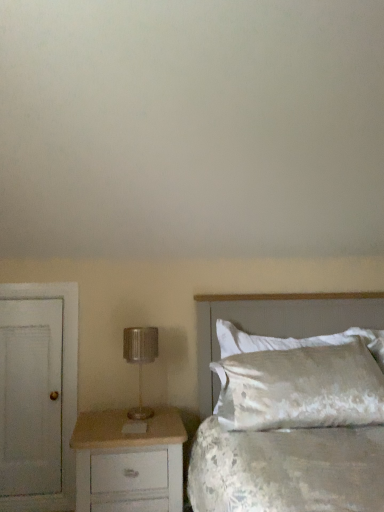
Question: Is metallic silver lamp at left turned away from satin white pillow at right?

Choices:
 (A) no
 (B) yes

Answer: (A)

Question: Does metallic silver lamp at left come in front of satin white pillow at right?

Choices:
 (A) yes
 (B) no

Answer: (A)

Question: Could you tell me if metallic silver lamp at left is turned towards satin white pillow at right?

Choices:
 (A) no
 (B) yes

Answer: (A)

Question: Is metallic silver lamp at left with satin white pillow at right?

Choices:
 (A) no
 (B) yes

Answer: (A)

Question: Does metallic silver lamp at left have a greater width compared to satin white pillow at right?

Choices:
 (A) yes
 (B) no

Answer: (A)

Question: From the image's perspective, would you say metallic silver lamp at left is positioned over satin white pillow at right?

Choices:
 (A) no
 (B) yes

Answer: (B)

Question: Considering the relative sizes of white matte door at left and white painted wood chest of drawers at lower left in the image provided, is white matte door at left bigger than white painted wood chest of drawers at lower left?

Choices:
 (A) no
 (B) yes

Answer: (A)

Question: Does white matte door at left have a lesser height compared to white painted wood chest of drawers at lower left?

Choices:
 (A) no
 (B) yes

Answer: (A)

Question: Considering the relative positions of white matte door at left and white painted wood chest of drawers at lower left in the image provided, is white matte door at left to the left of white painted wood chest of drawers at lower left from the viewer's perspective?

Choices:
 (A) no
 (B) yes

Answer: (B)

Question: Could you tell me if white matte door at left is facing white painted wood chest of drawers at lower left?

Choices:
 (A) no
 (B) yes

Answer: (A)

Question: Can you confirm if white matte door at left is smaller than white painted wood chest of drawers at lower left?

Choices:
 (A) no
 (B) yes

Answer: (B)

Question: Is the surface of white matte door at left in direct contact with white painted wood chest of drawers at lower left?

Choices:
 (A) yes
 (B) no

Answer: (B)

Question: Is white matte door at left taller than satin white pillow at right?

Choices:
 (A) no
 (B) yes

Answer: (B)